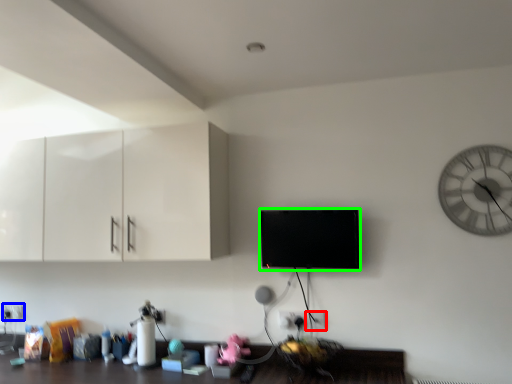
Question: Based on their relative distances, which object is farther from electric outlet (highlighted by a red box)? Choose from electric outlet (highlighted by a blue box) and flat (highlighted by a green box).

Choices:
 (A) electric outlet
 (B) flat

Answer: (A)